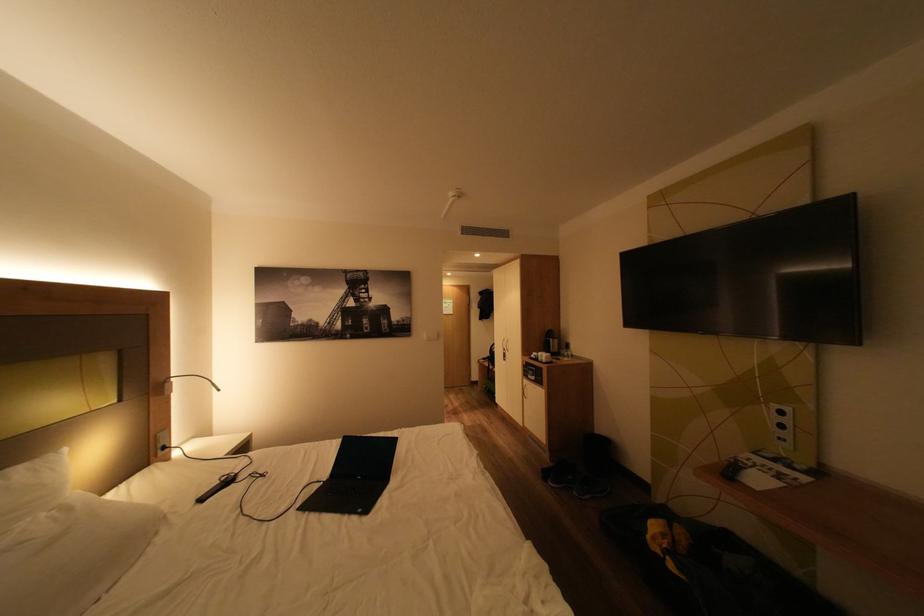
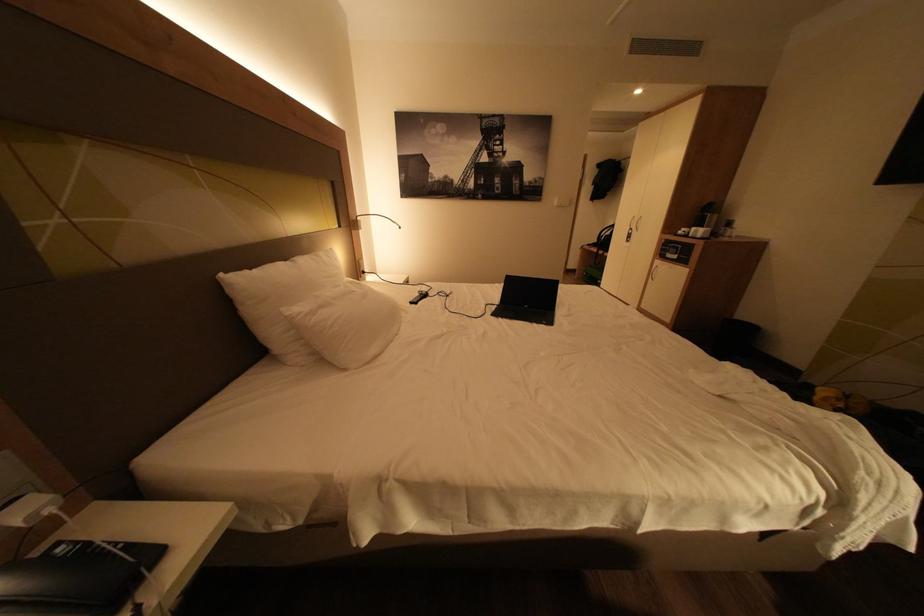
Question: The images are taken continuously from a first-person perspective. In which direction are you moving?

Choices:
 (A) Left
 (B) Right
 (C) Forward
 (D) Backward

Answer: (A)